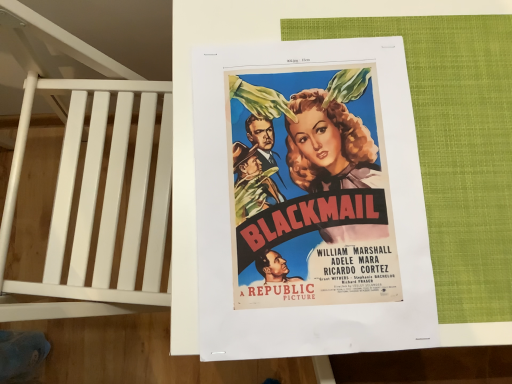
Identify the location of empty space that is ontop of matte paper poster at center (from a real-world perspective). (370, 147).